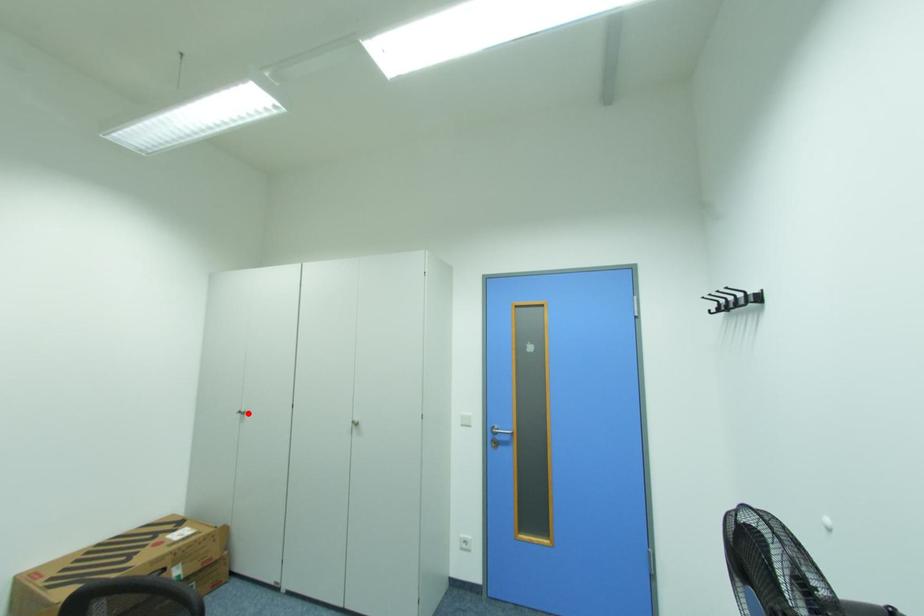
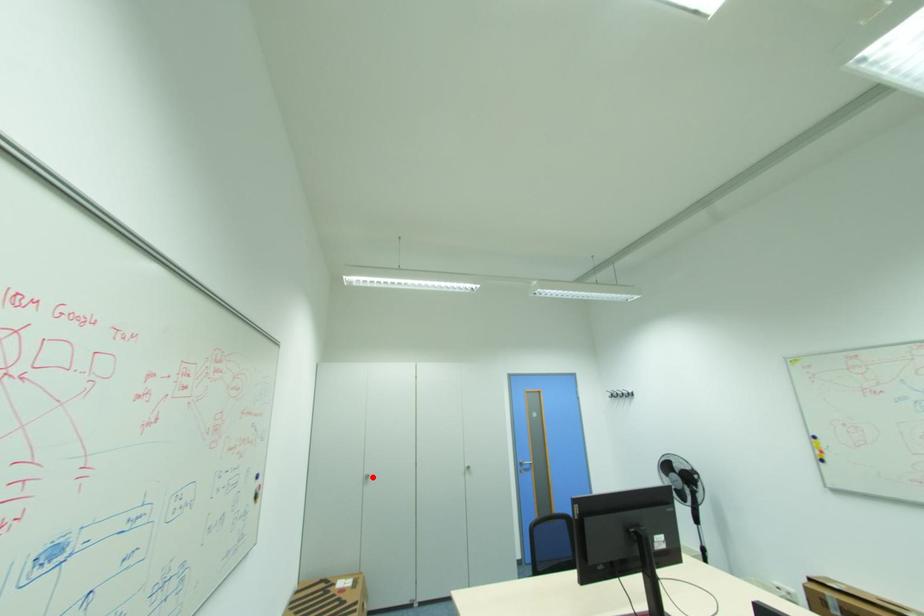
I am providing you with two images of the same scene from different viewpoints. A red point is marked on the first image and another point is marked on the second image. Do the highlighted points in image1 and image2 indicate the same real-world spot?

Yes